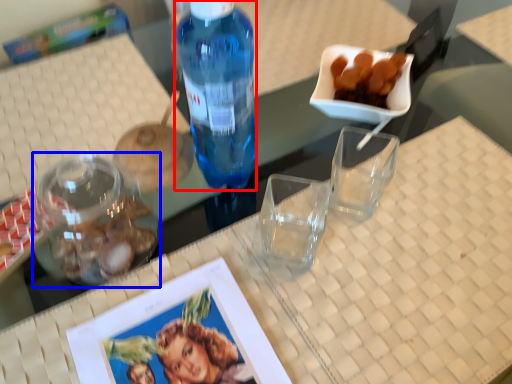
Question: Which object is further to the camera taking this photo, bottle (highlighted by a red box) or tableware (highlighted by a blue box)?

Choices:
 (A) bottle
 (B) tableware

Answer: (B)